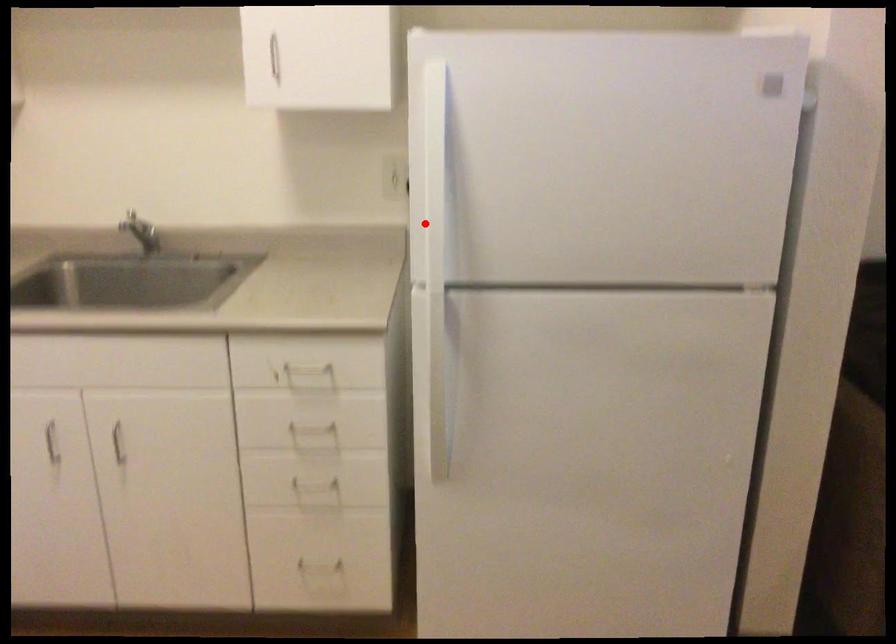
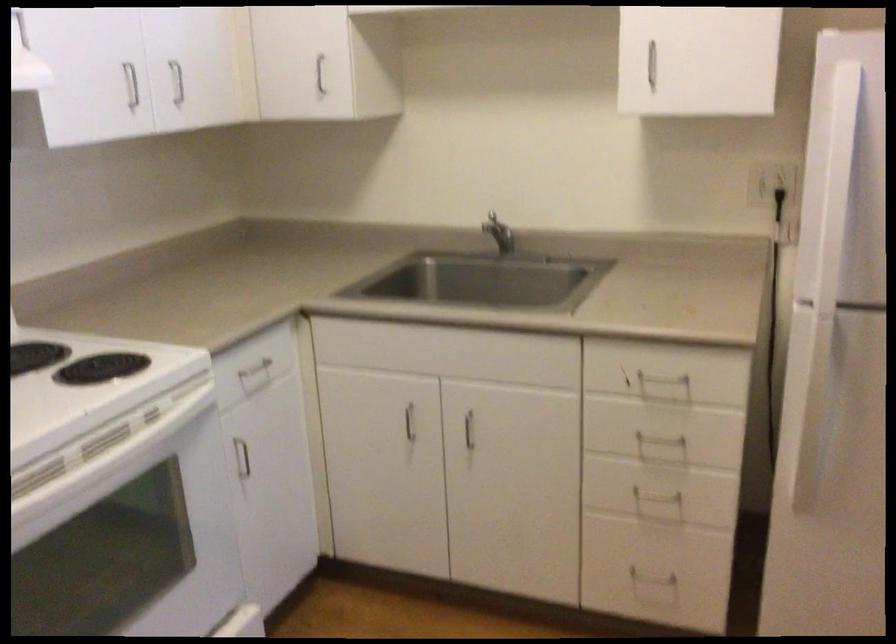
Question: A red point is marked in image1. In image2, is the corresponding 3D point closer to the camera or farther? Reply with the corresponding letter.

Choices:
 (A) The corresponding 3D point is closer.
 (B) The corresponding 3D point is farther.

Answer: (A)